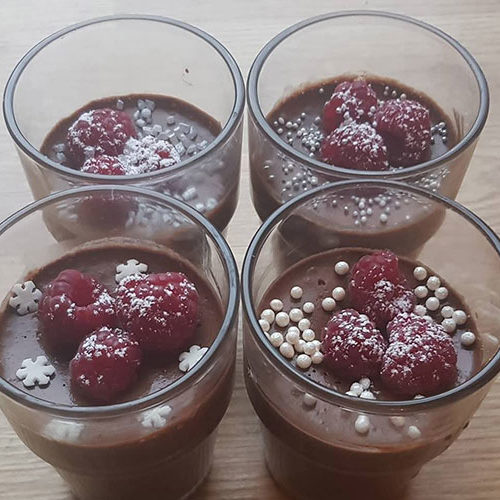
Locate an element on the screen. The width and height of the screenshot is (500, 500). countertop is located at coordinates (246, 219).